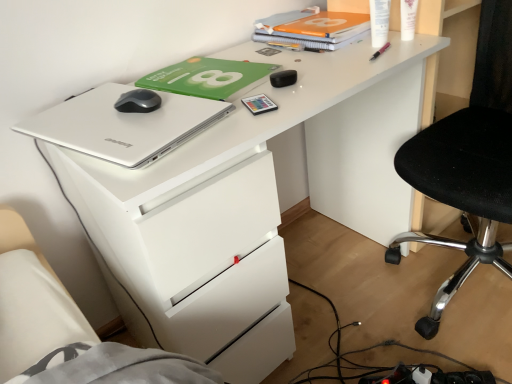
This screenshot has height=384, width=512. What are the coordinates of `vacant space in front of white plastic bottle at upper right, which is the fourth stationery from left to right` in the screenshot? It's located at (378, 60).